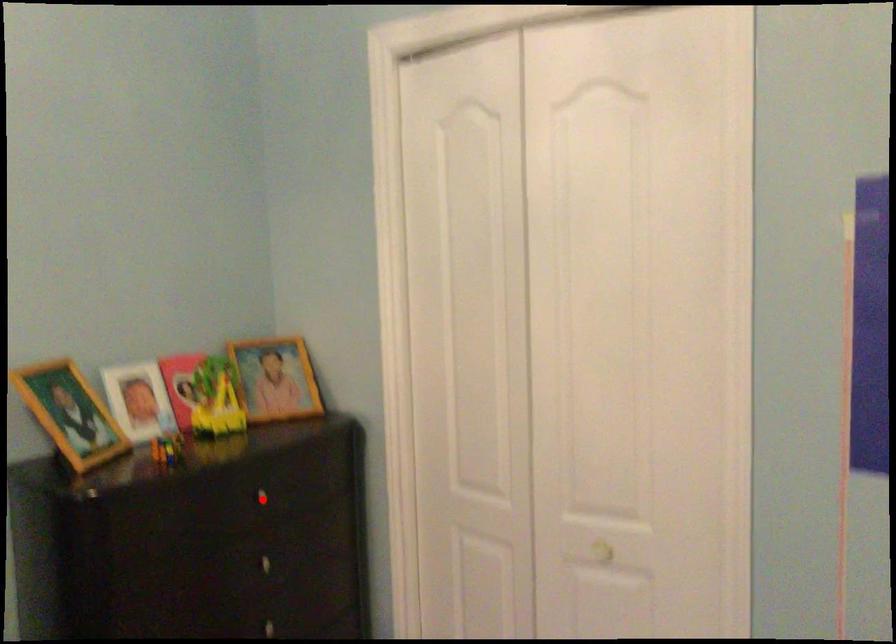
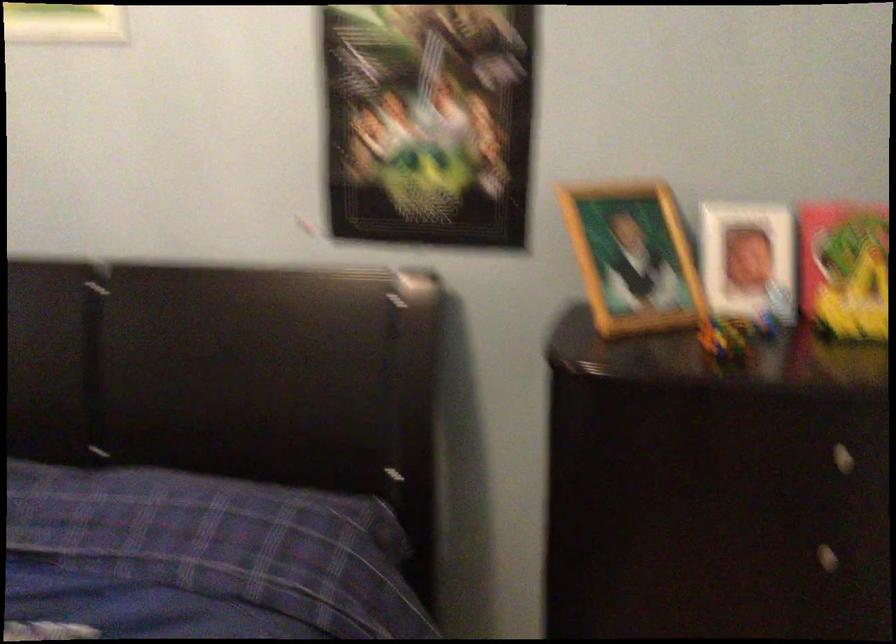
Where in the second image is the point corresponding to the highlighted location from the first image?

(840, 458)